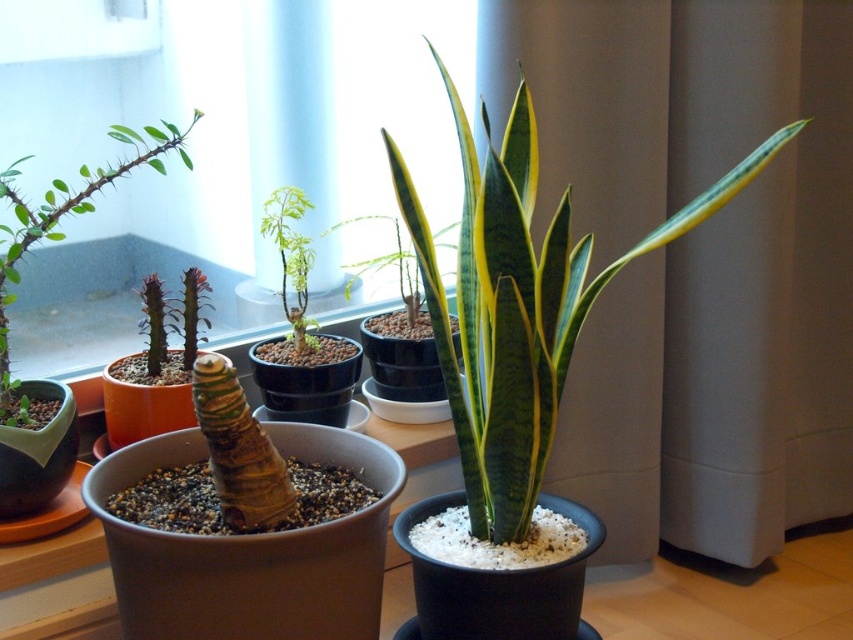
You are standing in front of the potted plants on the windowsill. There are two points marked on the image. The first point is at coordinates point (73, 154) and the second is at point (13, 236). Which point is closer to you?

Point (73, 154) is further to the viewer than point (13, 236), so the first point is closer to you.

You are a gardener who wants to water the green spiky cactus at left and the green matte plant at center. Which one should you water first if you want to start from the closest to the furthest position relative to you?

You should water the green spiky cactus at left first because it is closer to you than the green matte plant at center.

You are a plant enthusiast who wants to know if the transparent glass window at upper center can block sunlight from reaching the green spiky cactus at left. Based on their positions and sizes, can you determine if the window will cast a shadow over the cactus?

The transparent glass window at upper center is taller than the green spiky cactus at left, so it could potentially cast a shadow over the cactus if positioned between the light source and the cactus.